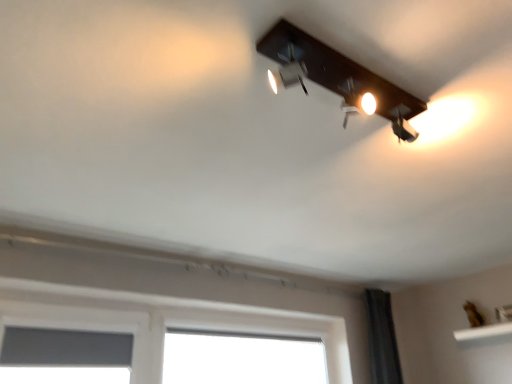
Question: Visually, is matte gray window screen at lower left positioned to the left or to the right of matte black light fixture at upper center?

Choices:
 (A) right
 (B) left

Answer: (B)

Question: Considering the positions of point (20, 354) and point (393, 110), is point (20, 354) closer or farther from the camera than point (393, 110)?

Choices:
 (A) closer
 (B) farther

Answer: (B)

Question: From the image's perspective, relative to matte black light fixture at upper center, is matte gray window screen at lower left above or below?

Choices:
 (A) above
 (B) below

Answer: (B)

Question: Relative to matte gray window screen at lower left, is matte black light fixture at upper center in front or behind?

Choices:
 (A) behind
 (B) front

Answer: (B)

Question: Choose the correct answer: Is matte black light fixture at upper center inside matte gray window screen at lower left or outside it?

Choices:
 (A) inside
 (B) outside

Answer: (B)

Question: Considering the positions of matte black light fixture at upper center and matte gray window screen at lower left in the image, is matte black light fixture at upper center taller or shorter than matte gray window screen at lower left?

Choices:
 (A) short
 (B) tall

Answer: (A)

Question: Considering the positions of point (311, 49) and point (89, 344), is point (311, 49) closer or farther from the camera than point (89, 344)?

Choices:
 (A) farther
 (B) closer

Answer: (B)